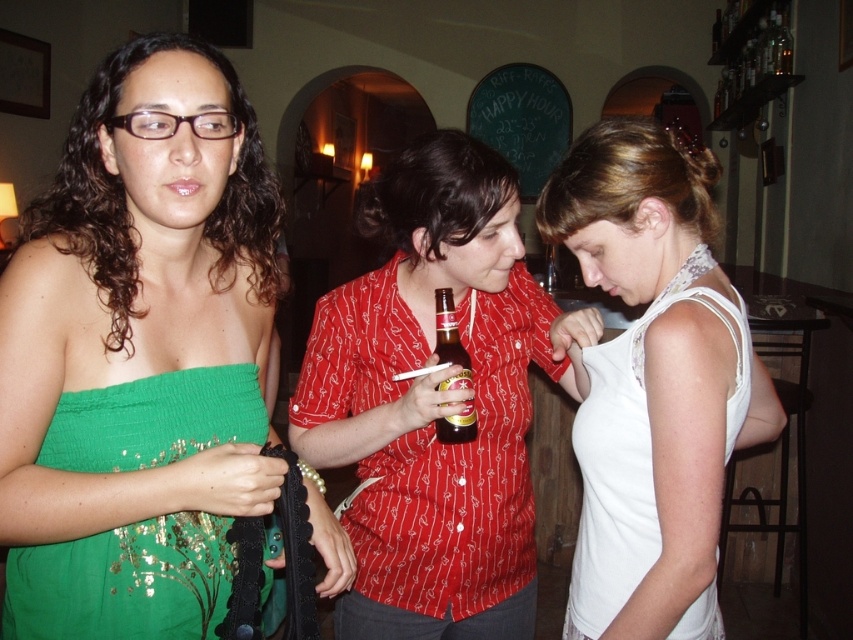
Question: Which object is positioned closest to the green sequined dress at left?

Choices:
 (A) matte red shirt at center
 (B) white lace tank top at center

Answer: (A)

Question: Can you confirm if green sequined dress at left is smaller than white lace tank top at center?

Choices:
 (A) no
 (B) yes

Answer: (A)

Question: Does matte red shirt at center appear on the right side of brown glass bottle at center?

Choices:
 (A) yes
 (B) no

Answer: (B)

Question: Among these objects, which one is farthest from the camera?

Choices:
 (A) matte red shirt at center
 (B) white lace tank top at center
 (C) brown glass bottle at center
 (D) green sequined dress at center

Answer: (C)

Question: Which point is farther to the camera?

Choices:
 (A) (637, 547)
 (B) (440, 358)
 (C) (399, 608)

Answer: (C)

Question: Is green sequined dress at center positioned before brown glass bottle at center?

Choices:
 (A) yes
 (B) no

Answer: (A)